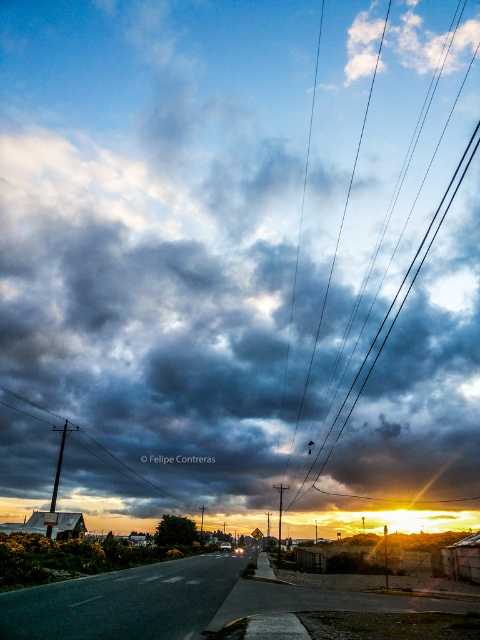
Question: Based on their relative distances, which object is farther from the black wire at upper center?

Choices:
 (A) dark gray wooden pole at left
 (B) smooth metallic pole at center

Answer: (A)

Question: Can you confirm if black wire at upper center is positioned above smooth metallic pole at center?

Choices:
 (A) no
 (B) yes

Answer: (B)

Question: Which point appears farthest from the camera in this image?

Choices:
 (A) (280, 509)
 (B) (369, 348)
 (C) (11, 394)

Answer: (C)

Question: Can you confirm if dark gray wooden pole at left is positioned to the left of smooth metallic pole at center?

Choices:
 (A) yes
 (B) no

Answer: (A)

Question: Which of the following is the farthest from the observer?

Choices:
 (A) dark gray wooden pole at left
 (B) black wire at upper center
 (C) smooth metallic pole at center

Answer: (B)

Question: Can you confirm if black wire at upper center is positioned below dark gray wooden pole at left?

Choices:
 (A) yes
 (B) no

Answer: (B)